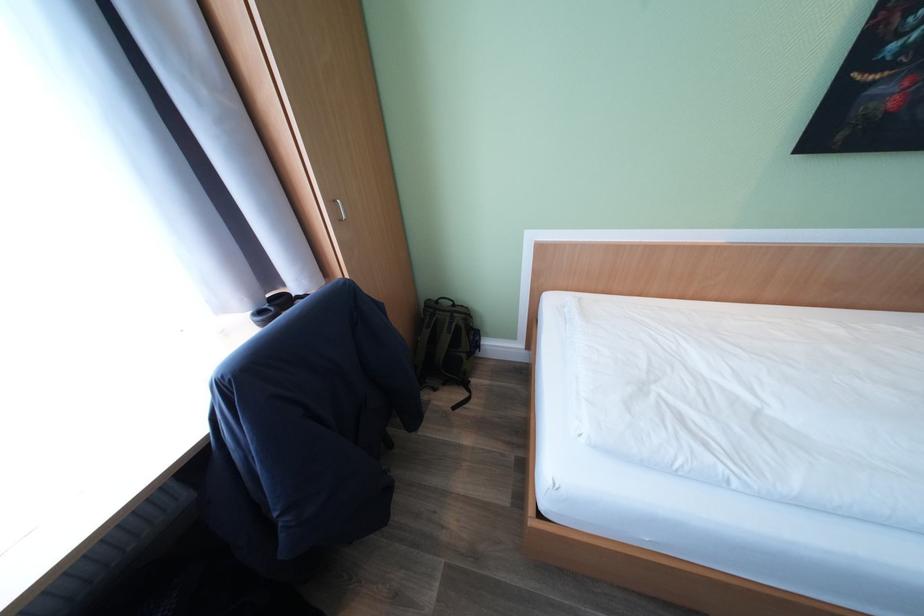
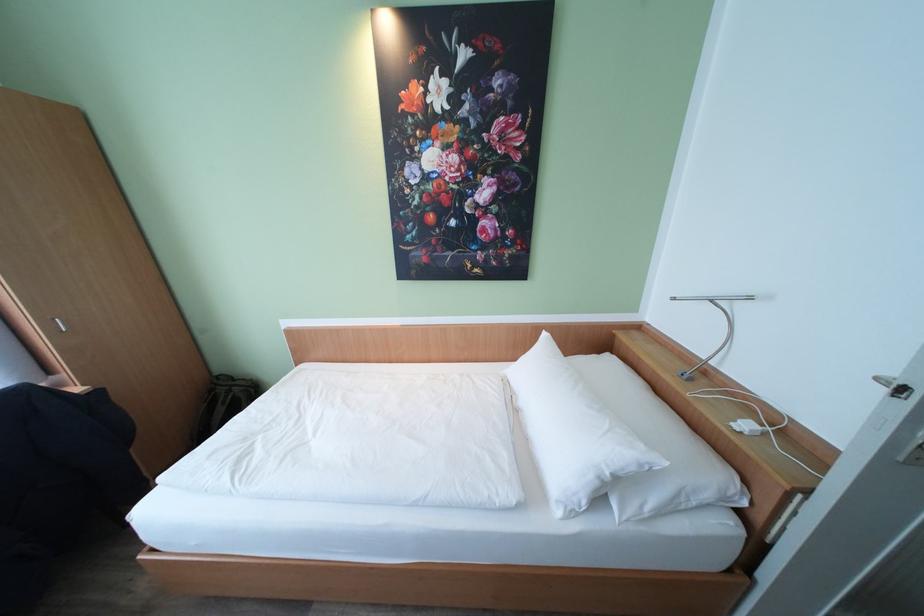
In the second image, find the point that corresponds to point 463,315 in the first image.

(241, 389)